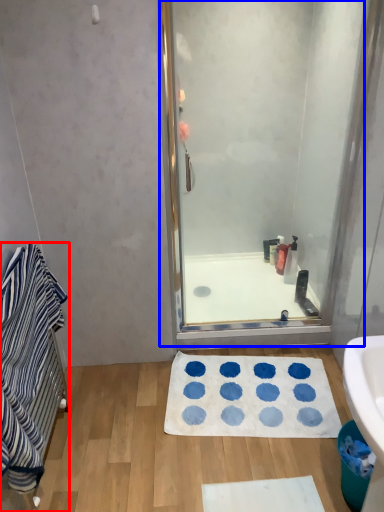
Question: Which object appears closest to the camera in this image, bathroom cabinet (highlighted by a red box) or shower door (highlighted by a blue box)?

Choices:
 (A) bathroom cabinet
 (B) shower door

Answer: (A)